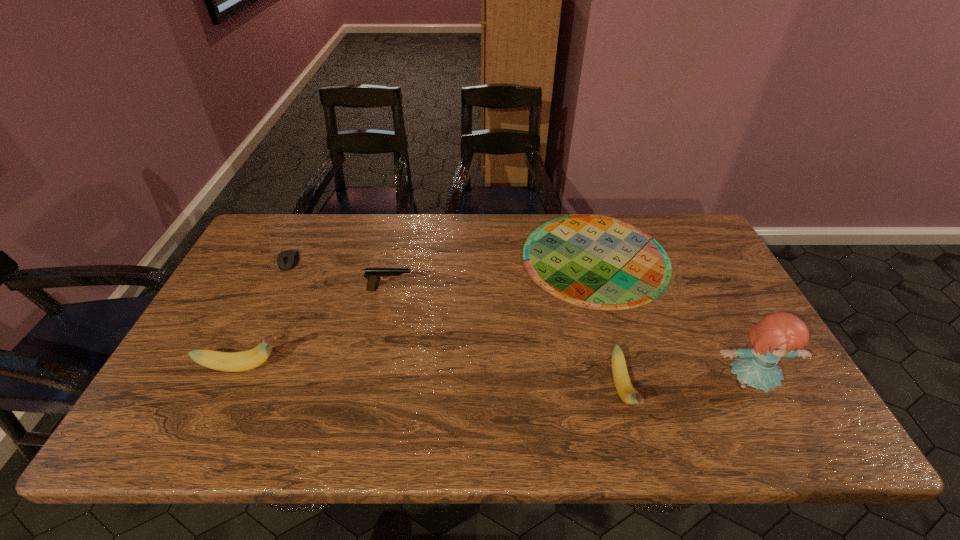
Where is `the left banana`? Image resolution: width=960 pixels, height=540 pixels. the left banana is located at coordinates (246, 360).

Find the location of a particular element. the taller banana is located at coordinates (246, 360).

At what (x,y) coordinates should I click in order to perform the action: click on the shorter banana. Please return your answer as a coordinate pair (x, y). The width and height of the screenshot is (960, 540). Looking at the image, I should click on (623, 384).

This screenshot has height=540, width=960. I want to click on the shortest object, so click(596, 262).

At what (x,y) coordinates should I click in order to perform the action: click on the fifth tallest object. Please return your answer as a coordinate pair (x, y). Looking at the image, I should click on (286, 260).

At what (x,y) coordinates should I click in order to perform the action: click on the third object from left to right. Please return your answer as a coordinate pair (x, y). The height and width of the screenshot is (540, 960). Looking at the image, I should click on (374, 275).

This screenshot has width=960, height=540. In order to click on the tallest object in this screenshot , I will do `click(778, 335)`.

Locate an element on the screen. This screenshot has width=960, height=540. vacant region located at the stem of the taller banana is located at coordinates (355, 367).

Identify the location of free space located on the left of the shortest object. (475, 258).

Where is `free spot located on the right of the computer equipment`? Image resolution: width=960 pixels, height=540 pixels. free spot located on the right of the computer equipment is located at coordinates (324, 262).